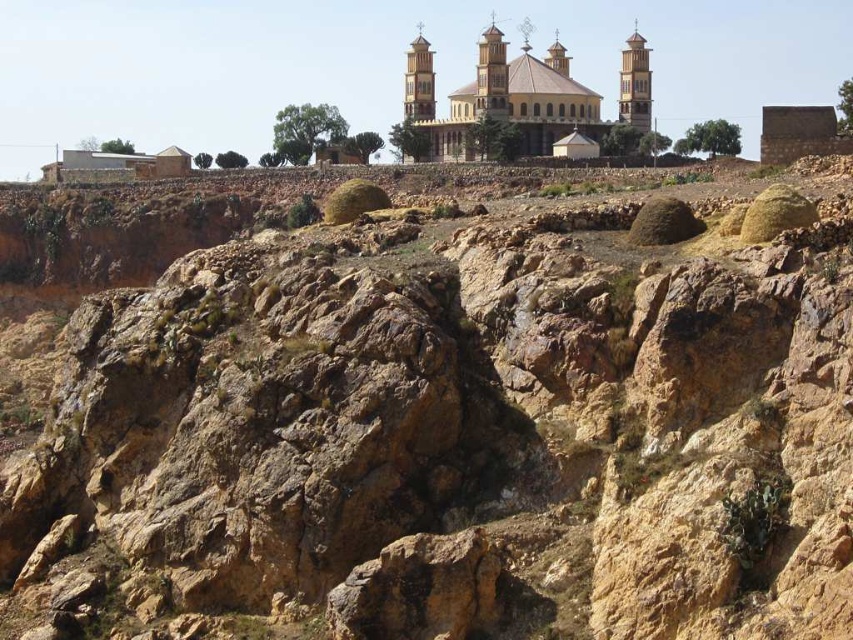
In the scene shown: You are a photographer planning to capture a wide shot of the golden stone church at upper center and the wooden tower at upper right. Based on their sizes, which object should you position closer to the center of the frame to ensure both are fully visible in the shot?

The golden stone church at upper center is wider than the wooden tower at upper right, so positioning it closer to the center of the frame will ensure both objects are fully visible in the shot.

You are a hiker who wants to take a photo of the golden stone church at upper center and the wooden tower at upper right. Which object should you stand closer to in order to capture both in the same frame?

You should stand closer to the wooden tower at upper right because the golden stone church at upper center is much taller than the wooden tower. By moving closer to the shorter wooden tower, you can include both the taller church and the tower within the camera frame more effectively.

You are a hiker who has just arrived at the base of the rocky landscape. You notice the golden stone church at upper center and the wooden tower at upper right in the distance. If you want to visit both landmarks, which one would require a longer walk from your current position?

The golden stone church at upper center is 37.16 feet from the wooden tower at upper right. Since you are at the base of the rocky landscape, the wooden tower at upper right would require a longer walk because it is farther away from the church, which might be closer to your starting point.